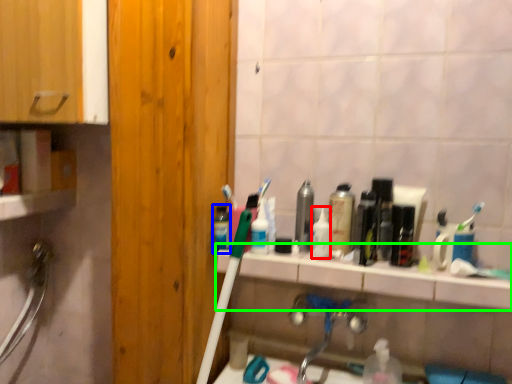
Question: Which object is positioned farthest from toiletry (highlighted by a red box)? Select from mouthwash (highlighted by a blue box) and counter top (highlighted by a green box).

Choices:
 (A) mouthwash
 (B) counter top

Answer: (A)